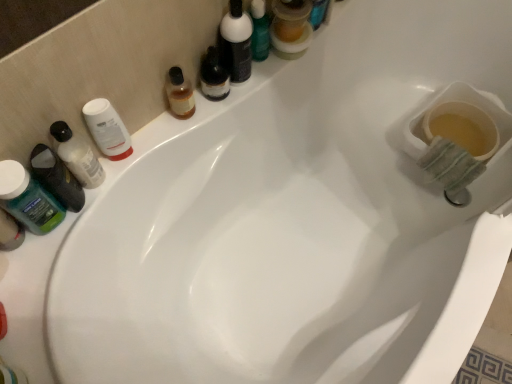
Question: In which direction should I rotate to look at matte black bottle at upper center, arranged as the 2th toiletry when viewed from the left?

Choices:
 (A) left
 (B) right

Answer: (A)

Question: From a real-world perspective, is translucent plastic bottle at left, which appears as the 2th toiletry when viewed from the right, positioned under white matte jar at upper left, the 3th mouthwash positioned from the right, based on gravity?

Choices:
 (A) yes
 (B) no

Answer: (A)

Question: Is translucent plastic bottle at left, the first toiletry when ordered from left to right, oriented towards white matte jar at upper left, which appears as the 3th mouthwash when viewed from the left?

Choices:
 (A) yes
 (B) no

Answer: (B)

Question: Would you consider translucent plastic bottle at left, acting as the 2th toiletry starting from the top, to be distant from white matte jar at upper left, which appears as the 3th mouthwash when viewed from the left?

Choices:
 (A) yes
 (B) no

Answer: (B)

Question: Does translucent plastic bottle at left, which appears as the 2th toiletry when viewed from the right, come behind white matte jar at upper left, the 3th mouthwash positioned from the right?

Choices:
 (A) no
 (B) yes

Answer: (A)

Question: Does translucent plastic bottle at left, which is the 1th toiletry from bottom to top, have a smaller size compared to white matte jar at upper left, which appears as the 3th mouthwash when viewed from the left?

Choices:
 (A) yes
 (B) no

Answer: (B)

Question: From the image's perspective, would you say translucent plastic bottle at left, which appears as the 2th toiletry when viewed from the right, is positioned over white matte jar at upper left, the 3th mouthwash positioned from the right?

Choices:
 (A) no
 (B) yes

Answer: (A)

Question: From a real-world perspective, is translucent amber liquid at upper center, the 4th mouthwash when ordered from left to right, on white matte jar at upper left, the 3th mouthwash positioned from the right?

Choices:
 (A) yes
 (B) no

Answer: (B)

Question: Is translucent amber liquid at upper center, the 4th mouthwash when ordered from left to right, positioned behind white matte jar at upper left, the 3th mouthwash positioned from the right?

Choices:
 (A) no
 (B) yes

Answer: (B)

Question: Can you confirm if translucent amber liquid at upper center, the 4th mouthwash when ordered from left to right, is shorter than white matte jar at upper left, the 3th mouthwash positioned from the right?

Choices:
 (A) yes
 (B) no

Answer: (A)

Question: From the image's perspective, is translucent amber liquid at upper center, the 4th mouthwash when ordered from left to right, located beneath white matte jar at upper left, the 3th mouthwash positioned from the right?

Choices:
 (A) yes
 (B) no

Answer: (B)

Question: Can you confirm if translucent amber liquid at upper center, the 2th mouthwash viewed from the right, is thinner than white matte jar at upper left, the 3th mouthwash positioned from the right?

Choices:
 (A) no
 (B) yes

Answer: (A)

Question: Is translucent amber liquid at upper center, the 2th mouthwash viewed from the right, bigger than white matte jar at upper left, which appears as the 3th mouthwash when viewed from the left?

Choices:
 (A) yes
 (B) no

Answer: (A)

Question: From the image's perspective, is translucent plastic mouthwash at upper center, positioned as the first mouthwash in right-to-left order, beneath matte black bottle at upper center, arranged as the 2th toiletry when viewed from the left?

Choices:
 (A) yes
 (B) no

Answer: (B)